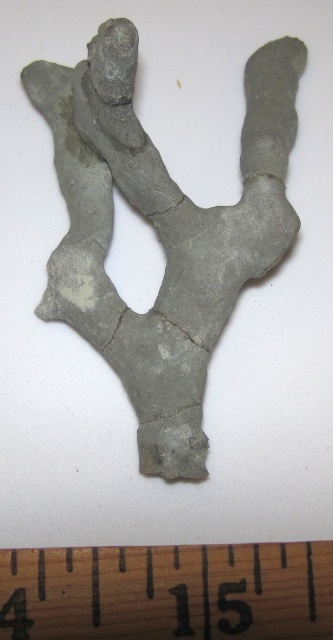
Between gray clay sculpture at center and wooden ruler at bottom, which one has more height?

gray clay sculpture at center is taller.

Is point (264, 124) farther from camera compared to point (49, 598)?

Yes, it is behind point (49, 598).

Is point (257, 76) positioned before point (206, 624)?

No, it is behind (206, 624).

Locate an element on the screen. gray clay sculpture at center is located at coordinates (161, 230).